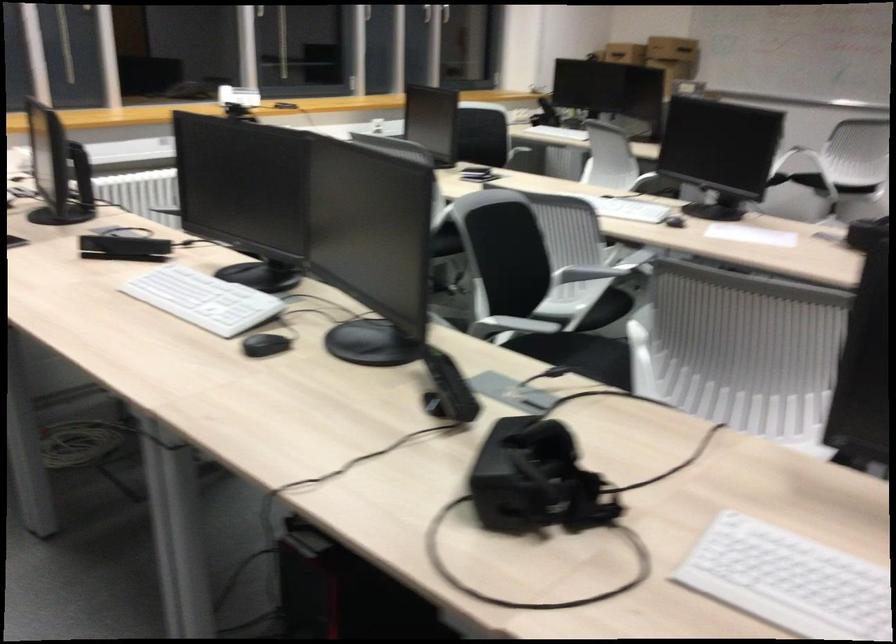
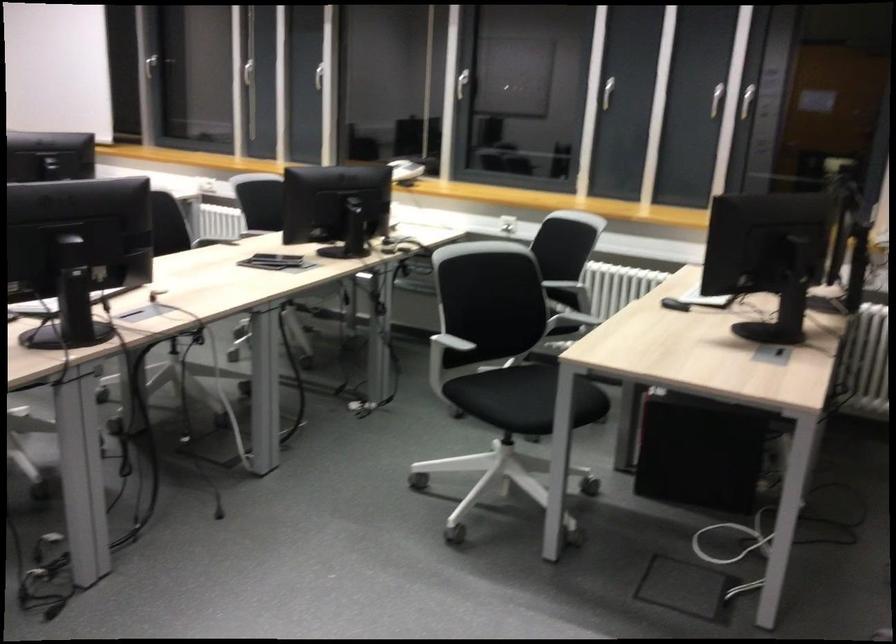
Find the pixel in the second image that matches pixel 495 158 in the first image.

(560, 283)